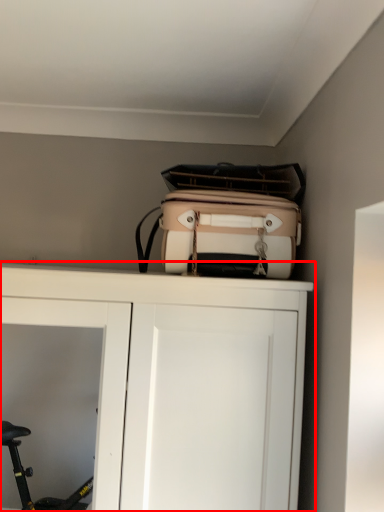
Question: From the image, what is the correct spatial relationship of cupboard (annotated by the red box) in relation to luggage and bags?

Choices:
 (A) left
 (B) right

Answer: (A)